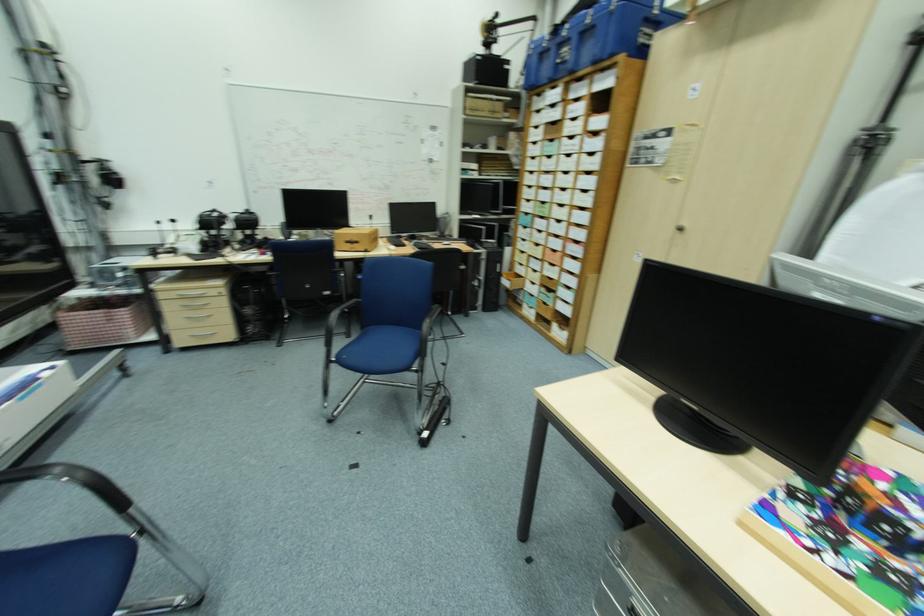
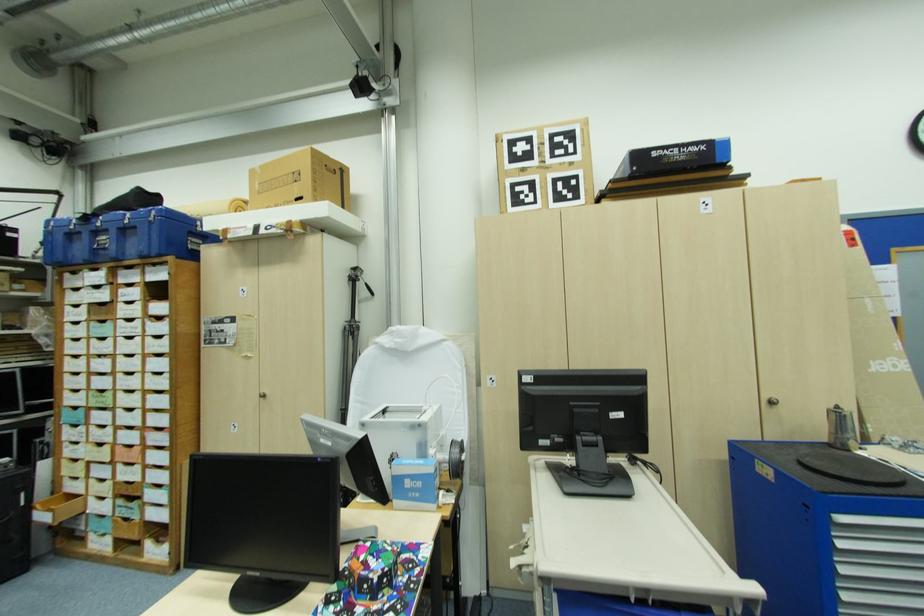
Question: The first image is from the beginning of the video and the second image is from the end. How did the camera likely rotate when shooting the video?

Choices:
 (A) Left
 (B) Right
 (C) Up
 (D) Down

Answer: (B)